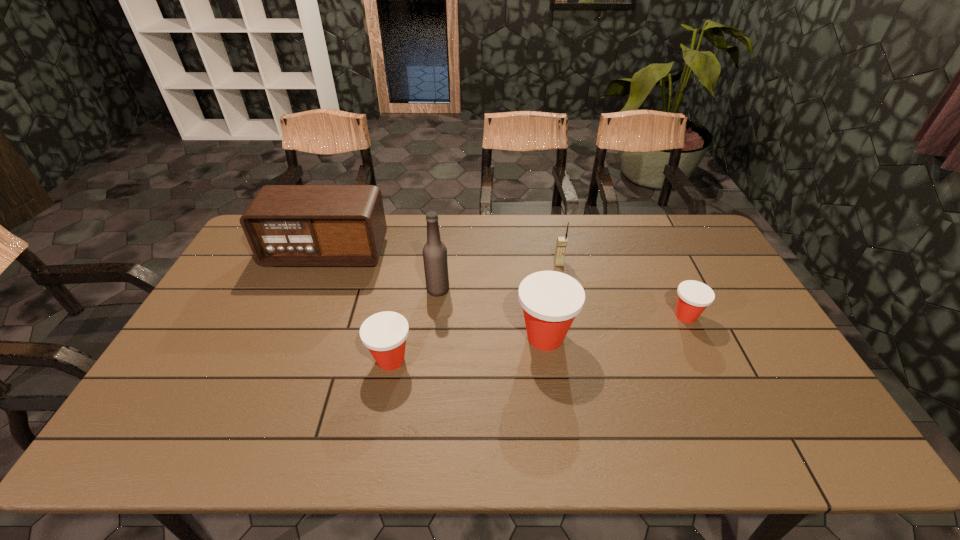
The height and width of the screenshot is (540, 960). What are the coordinates of `free area in between the cellular telephone and the fourth object from right to left` in the screenshot? It's located at (498, 276).

At what (x,y) coordinates should I click in order to perform the action: click on free space between the rightmost Dixie cup and the leftmost object. Please return your answer as a coordinate pair (x, y). The image size is (960, 540). Looking at the image, I should click on (507, 285).

Identify the location of vacant space that is in between the second Dixie cup from left to right and the leftmost Dixie cup. The width and height of the screenshot is (960, 540). (468, 348).

The image size is (960, 540). In order to click on object that stands as the fourth closest to the tallest object in this screenshot , I will do `click(562, 241)`.

Find the location of `object that is the third closest to the leftmost object`. object that is the third closest to the leftmost object is located at coordinates (550, 299).

Where is `Dixie cup that stands as the closest to the tallest object`? Image resolution: width=960 pixels, height=540 pixels. Dixie cup that stands as the closest to the tallest object is located at coordinates coord(384,334).

Identify which Dixie cup is located as the nearest to the fifth tallest object. Please provide its 2D coordinates. Your answer should be formatted as a tuple, i.e. [(x, y)], where the tuple contains the x and y coordinates of a point satisfying the conditions above.

[(550, 299)]

Where is `vacant position in the image that satisfies the following two spatial constraints: 1. on the front-facing side of the leftmost object; 2. on the right side of the rightmost Dixie cup`? The height and width of the screenshot is (540, 960). vacant position in the image that satisfies the following two spatial constraints: 1. on the front-facing side of the leftmost object; 2. on the right side of the rightmost Dixie cup is located at coordinates (301, 316).

Locate an element on the screen. vacant region that satisfies the following two spatial constraints: 1. on the label of the tallest Dixie cup; 2. on the left side of the tallest object is located at coordinates (433, 337).

This screenshot has width=960, height=540. I want to click on free space that satisfies the following two spatial constraints: 1. on the front-facing side of the second Dixie cup from right to left; 2. on the right side of the leftmost object, so click(x=293, y=337).